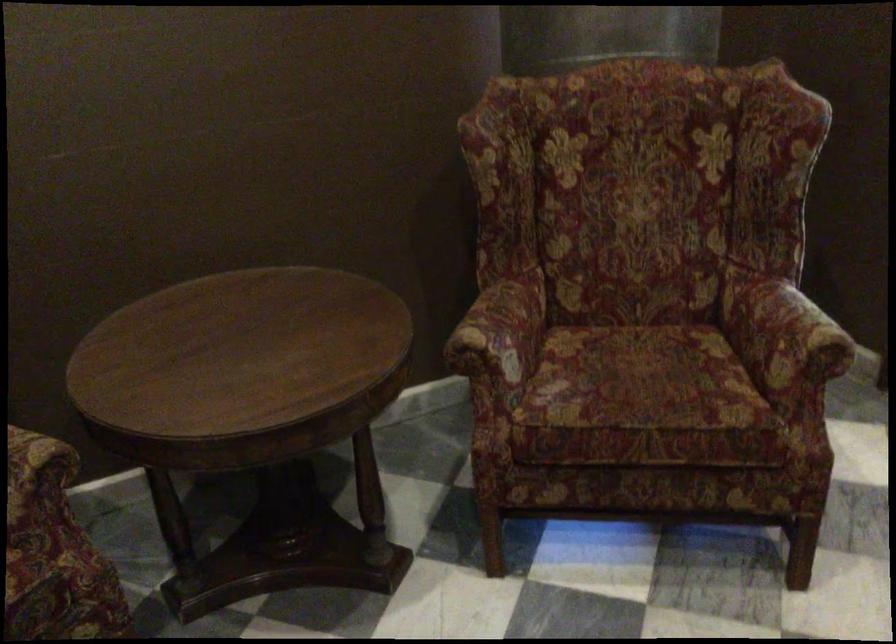
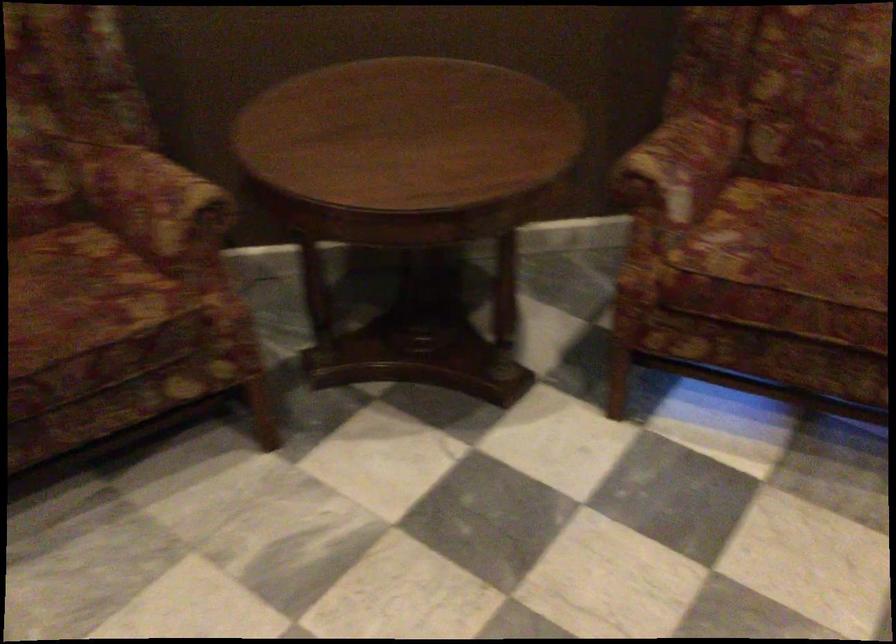
The point at [619,379] is marked in the first image. Where is the corresponding point in the second image?

(794, 243)